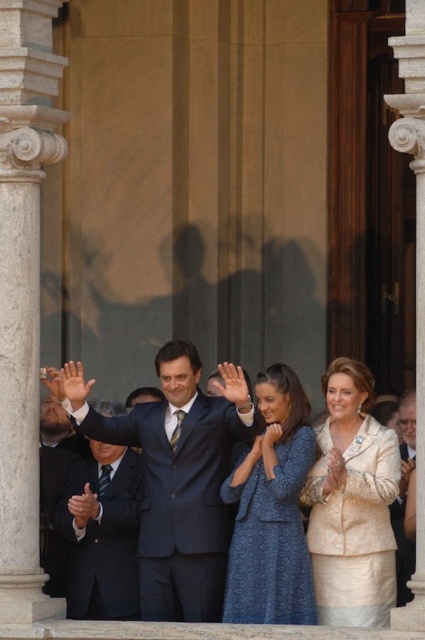
You are a photographer trying to capture a photo of the gold textured suit at center and the white marble pillar at right. Which object should you focus on first if you want to ensure both are in focus without adjusting your camera settings?

The gold textured suit at center is shorter than the white marble pillar at right. Since the gold textured suit at center is closer to the camera, you should focus on it first to ensure both are in focus without adjusting your camera settings.

You are a photographer trying to capture a clear photo of the two people in front of the door. Since the blue textured dress at center and the matte black suit at center are close to each other, which one should you focus on to ensure the subject is in focus if you can only focus on one?

The blue textured dress at center is bigger than the matte black suit at center, so focusing on the blue textured dress at center would ensure the subject is in focus as it occupies more space in the frame.